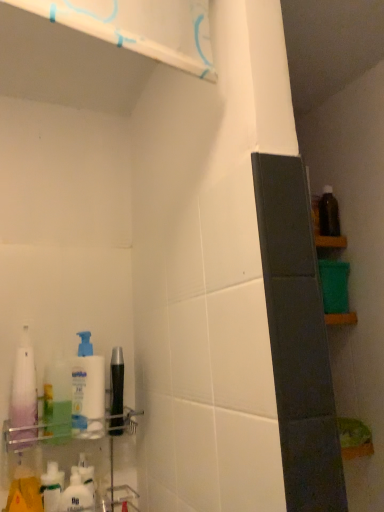
Question: Would you consider white glossy shelf at upper left, the first shelf from the top, to be distant from clear plastic shelf at lower left, positioned as the second shelf in top-to-bottom order?

Choices:
 (A) no
 (B) yes

Answer: (A)

Question: From a real-world perspective, is white glossy shelf at upper left, the second shelf in the back-to-front sequence, beneath clear plastic shelf at lower left, the 1th shelf positioned from the back?

Choices:
 (A) no
 (B) yes

Answer: (A)

Question: Can you confirm if white glossy shelf at upper left, the 2th shelf ordered from the bottom, is shorter than clear plastic shelf at lower left, the 1th shelf positioned from the back?

Choices:
 (A) no
 (B) yes

Answer: (B)

Question: Does white glossy shelf at upper left, the 2th shelf ordered from the bottom, come in front of clear plastic shelf at lower left, arranged as the 1th shelf when ordered from the bottom?

Choices:
 (A) yes
 (B) no

Answer: (A)

Question: From a real-world perspective, is white glossy shelf at upper left, the first shelf from the top, located higher than clear plastic shelf at lower left, the 1th shelf positioned from the back?

Choices:
 (A) no
 (B) yes

Answer: (B)

Question: Is white glossy shelf at upper left, which is counted as the first shelf, starting from the front, to the left or to the right of translucent purple bottle at left, marked as the 3th cleaning product in a right-to-left arrangement, in the image?

Choices:
 (A) right
 (B) left

Answer: (A)

Question: Is white glossy shelf at upper left, the second shelf in the back-to-front sequence, wider or thinner than translucent purple bottle at left, which is counted as the first cleaning product, starting from the left?

Choices:
 (A) thin
 (B) wide

Answer: (A)

Question: Do you think white glossy shelf at upper left, the second shelf in the back-to-front sequence, is within translucent purple bottle at left, which is counted as the first cleaning product, starting from the left, or outside of it?

Choices:
 (A) outside
 (B) inside

Answer: (A)

Question: From the image's perspective, is white glossy shelf at upper left, the 2th shelf ordered from the bottom, above or below translucent purple bottle at left, which is counted as the first cleaning product, starting from the left?

Choices:
 (A) above
 (B) below

Answer: (A)

Question: From their relative heights in the image, would you say white matte pump bottle at left, positioned as the 3th cleaning product in left-to-right order, is taller or shorter than white glossy shelf at upper left, which is counted as the first shelf, starting from the front?

Choices:
 (A) short
 (B) tall

Answer: (B)

Question: Considering the positions of white matte pump bottle at left, the first cleaning product positioned from the right, and white glossy shelf at upper left, the first shelf from the top, in the image, is white matte pump bottle at left, the first cleaning product positioned from the right, bigger or smaller than white glossy shelf at upper left, the first shelf from the top,?

Choices:
 (A) small
 (B) big

Answer: (A)

Question: Is white matte pump bottle at left, the first cleaning product positioned from the right, inside the boundaries of white glossy shelf at upper left, which is counted as the first shelf, starting from the front, or outside?

Choices:
 (A) outside
 (B) inside

Answer: (A)

Question: From a real-world perspective, is white matte pump bottle at left, positioned as the 3th cleaning product in left-to-right order, physically located above or below white glossy shelf at upper left, the 2th shelf ordered from the bottom?

Choices:
 (A) above
 (B) below

Answer: (B)

Question: Looking at the image, does white glossy lotion at lower left seem bigger or smaller compared to white glossy pump bottle at left, which is the second cleaning product in left-to-right order?

Choices:
 (A) big
 (B) small

Answer: (B)

Question: Is white glossy lotion at lower left inside the boundaries of white glossy pump bottle at left, arranged as the 2th cleaning product when viewed from the right, or outside?

Choices:
 (A) outside
 (B) inside

Answer: (A)